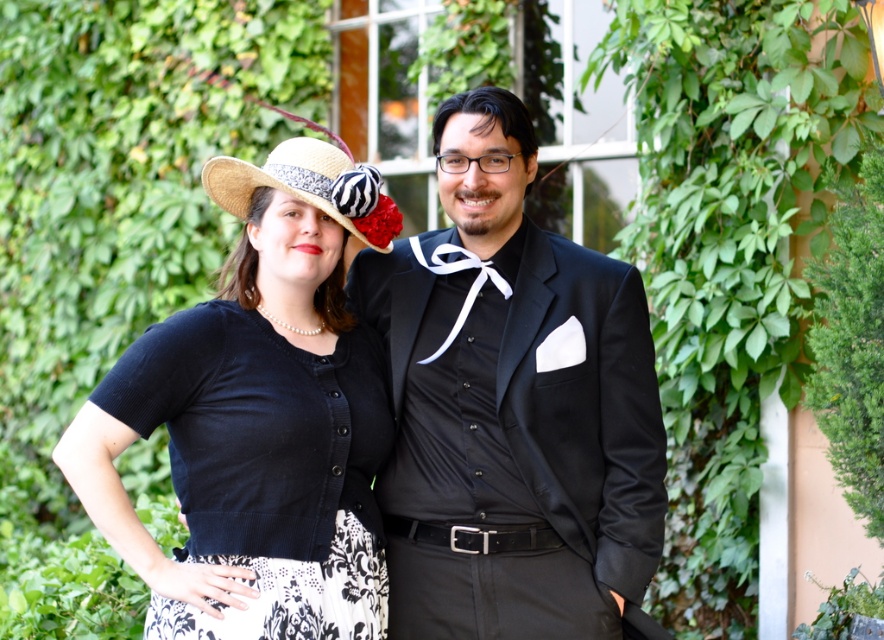
Question: Among these objects, which one is nearest to the camera?

Choices:
 (A) matte black cardigan at center
 (B) satin black suit at center

Answer: (A)

Question: Considering the relative positions of straw hat at center and white satin bow tie at center in the image provided, where is straw hat at center located with respect to white satin bow tie at center?

Choices:
 (A) right
 (B) left

Answer: (B)

Question: Can you confirm if matte black cardigan at center is positioned above straw hat at center?

Choices:
 (A) no
 (B) yes

Answer: (A)

Question: Where is matte black cardigan at center located in relation to white satin bow tie at center in the image?

Choices:
 (A) right
 (B) left

Answer: (B)

Question: Considering the real-world distances, which object is closest to the matte black cardigan at center?

Choices:
 (A) straw hat at center
 (B) satin black suit at center

Answer: (B)

Question: Which point appears farthest from the camera in this image?

Choices:
 (A) (219, 189)
 (B) (309, 372)

Answer: (A)